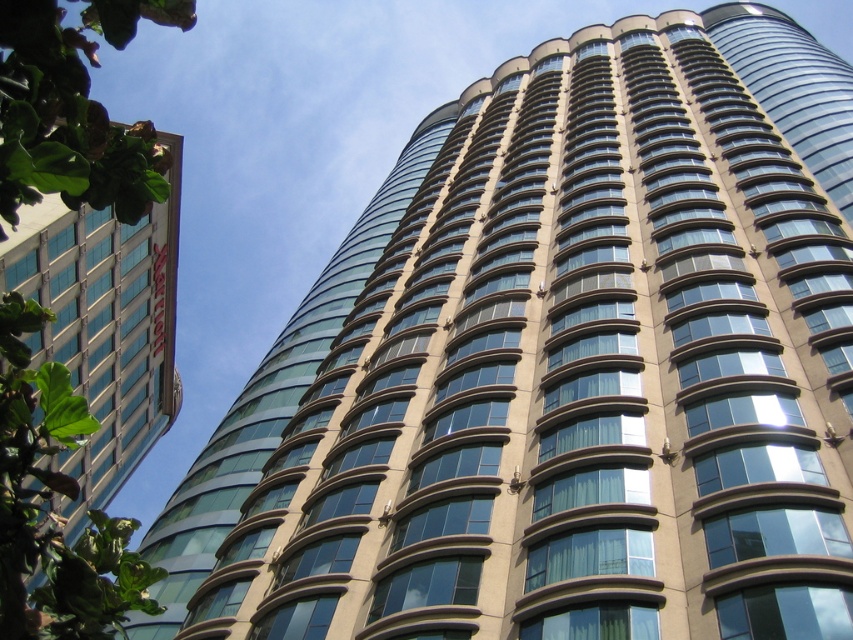
You are an architect analyzing the building structure. Which object, the glassy blue windows at upper left or the glassy tan tower at upper right, has a greater height?

The glassy tan tower at upper right is taller than the glassy blue windows at upper left.

You are standing in front of the modern architectural structure. You notice the glassy blue windows at upper left and the glassy tan tower at upper right. Which of these two objects is positioned more to the left side of the building?

The glassy blue windows at upper left is positioned more to the left side of the building than the glassy tan tower at upper right.